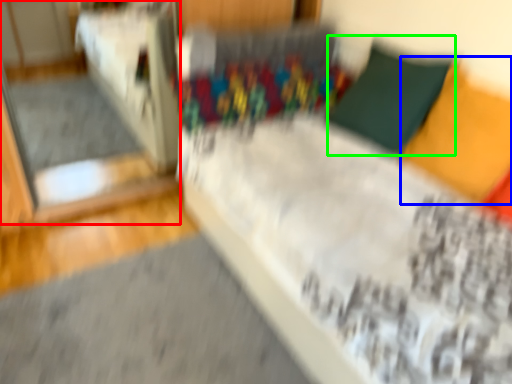
Question: Considering the real-world distances, which object is closest to glass door (highlighted by a red box)? pillow (highlighted by a blue box) or pillow (highlighted by a green box).

Choices:
 (A) pillow
 (B) pillow

Answer: (B)